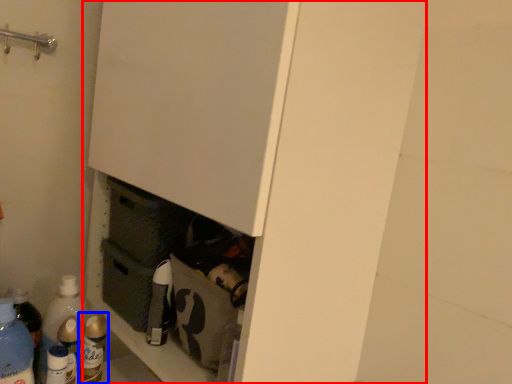
Question: Which of the following is the farthest to the observer, cupboard (highlighted by a red box) or bottle (highlighted by a blue box)?

Choices:
 (A) cupboard
 (B) bottle

Answer: (B)